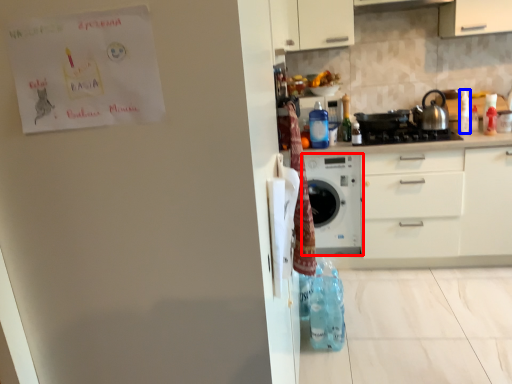
Question: Which object appears farthest to the camera in this image, home appliance (highlighted by a red box) or bottle (highlighted by a blue box)?

Choices:
 (A) home appliance
 (B) bottle

Answer: (B)